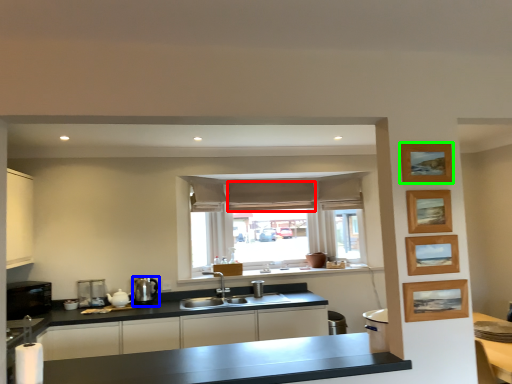
Question: Which object is positioned closest to curtain (highlighted by a red box)? Select from appliance (highlighted by a blue box) and picture frame (highlighted by a green box).

Choices:
 (A) appliance
 (B) picture frame

Answer: (A)